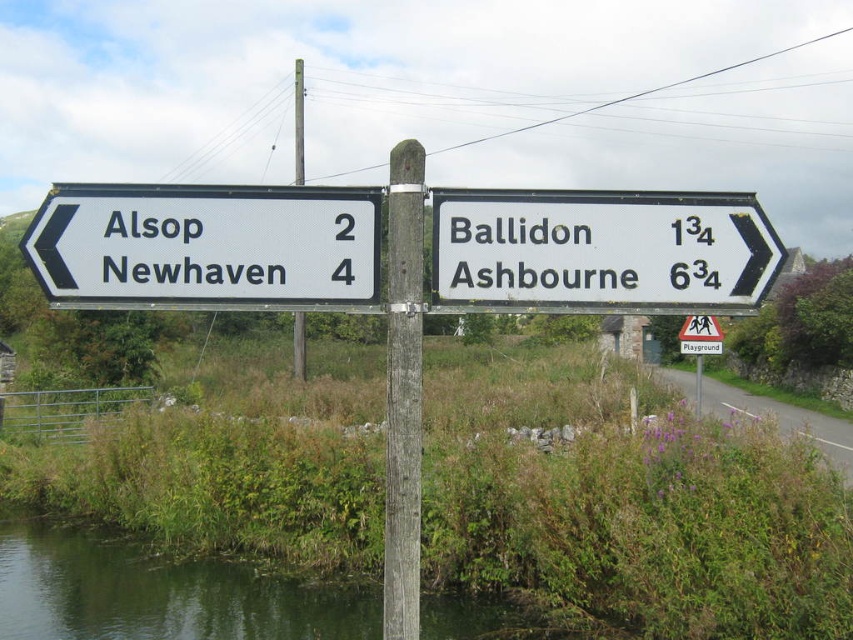
Does brown wooden pole at center have a lesser width compared to metallic pole at center?

Indeed, brown wooden pole at center has a lesser width compared to metallic pole at center.

Can you confirm if brown wooden pole at center is bigger than metallic pole at center?

Actually, brown wooden pole at center might be smaller than metallic pole at center.

Between point (421, 376) and point (300, 138), which one is positioned in front?

Positioned in front is point (421, 376).

Locate an element on the screen. This screenshot has height=640, width=853. brown wooden pole at center is located at coordinates point(403,392).

From the picture: Who is positioned more to the right, green grassy river at lower left or metallic pole at center?

From the viewer's perspective, green grassy river at lower left appears more on the right side.

Who is more distant from viewer, (227, 589) or (299, 173)?

The point (299, 173) is behind.

This screenshot has height=640, width=853. I want to click on green grassy river at lower left, so click(x=157, y=592).

Which is behind, point (428, 636) or point (409, 150)?

Point (428, 636)

Does point (538, 630) lie in front of point (405, 285)?

No, (538, 630) is further to viewer.

Does point (21, 621) come in front of point (403, 173)?

No.

Where is `green grassy river at lower left`? Image resolution: width=853 pixels, height=640 pixels. green grassy river at lower left is located at coordinates [x=157, y=592].